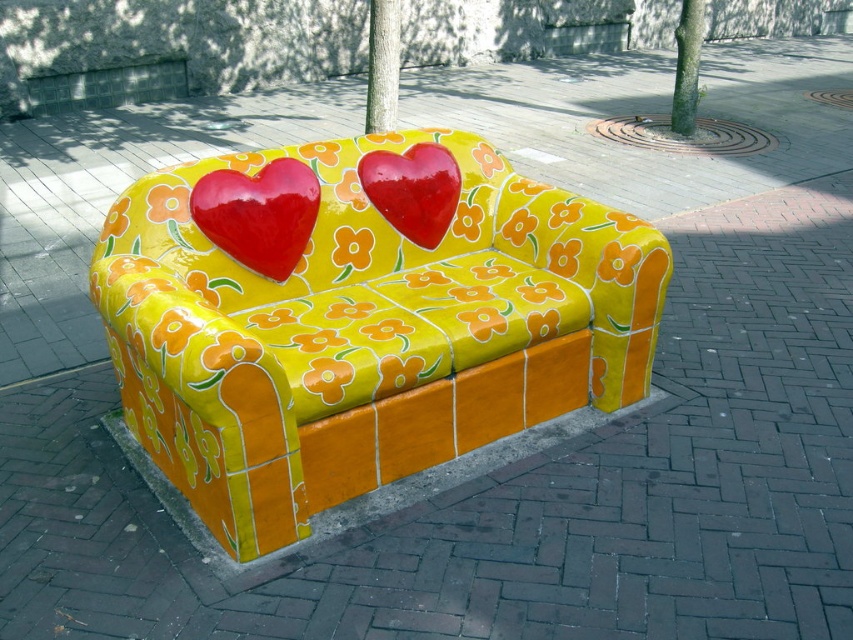
Between yellow glossy couch at center and orange tile curb at lower center, which one has less height?

orange tile curb at lower center

Between point (317, 326) and point (491, 465), which one is positioned in front?

Point (317, 326) is more forward.

At what (x,y) coordinates should I click in order to perform the action: click on yellow glossy couch at center. Please return your answer as a coordinate pair (x, y). Image resolution: width=853 pixels, height=640 pixels. Looking at the image, I should click on (357, 324).

What do you see at coordinates (357, 324) in the screenshot?
I see `yellow glossy couch at center` at bounding box center [357, 324].

Is yellow glossy couch at center below glossy ceramic heart at center?

Correct, yellow glossy couch at center is located below glossy ceramic heart at center.

Is point (189, 484) farther from camera compared to point (396, 216)?

No, it is in front of (396, 216).

Identify the location of yellow glossy couch at center. 357,324.

Which of these two, orange tile curb at lower center or glossy red heart at center, stands shorter?

Standing shorter between the two is glossy red heart at center.

Which is below, orange tile curb at lower center or glossy red heart at center?

Positioned lower is orange tile curb at lower center.

Who is more forward, (229, 561) or (198, 188)?

Positioned in front is point (229, 561).

The height and width of the screenshot is (640, 853). What are the coordinates of `orange tile curb at lower center` in the screenshot? It's located at (x=373, y=490).